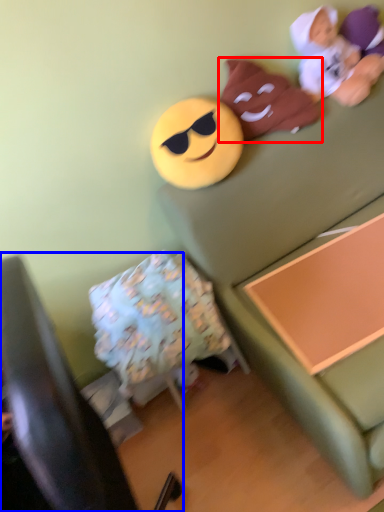
Question: Among these objects, which one is nearest to the camera, toy (highlighted by a red box) or furniture (highlighted by a blue box)?

Choices:
 (A) toy
 (B) furniture

Answer: (B)